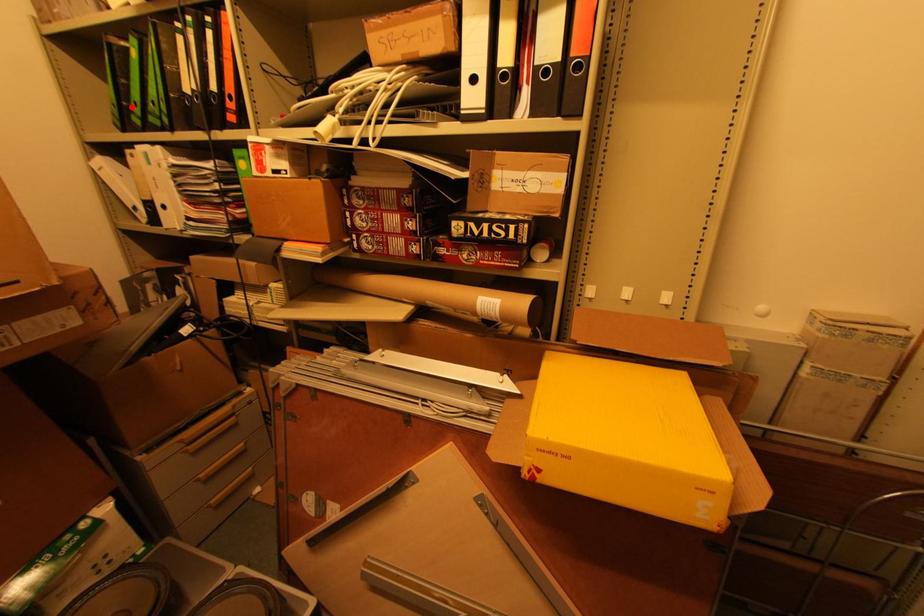
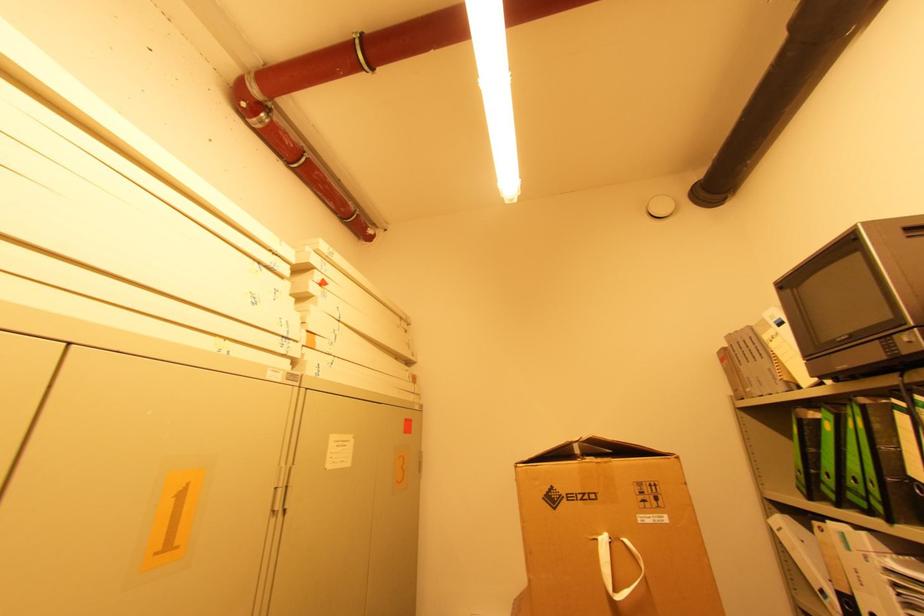
Question: I am providing you with two images of the same scene from different viewpoints. Image1 has a red point marked. In image2, the corresponding 3D location appears at what relative position? Reply with the corresponding letter.

Choices:
 (A) Closer
 (B) Farther

Answer: (A)